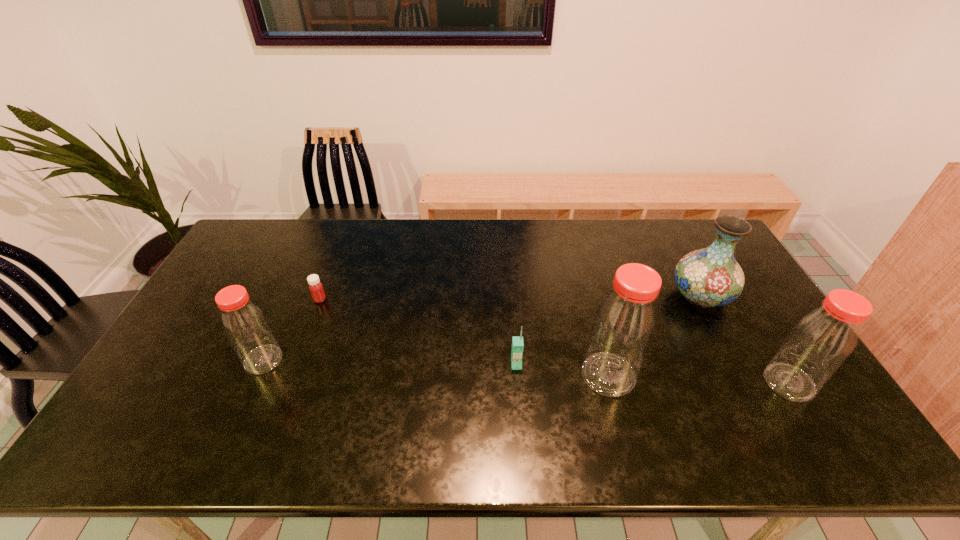
The width and height of the screenshot is (960, 540). I want to click on vacant region located 0.070m on the left of the second bottle from left to right, so click(555, 375).

Where is `vacant space located 0.320m on the back of the second tallest bottle`? The width and height of the screenshot is (960, 540). vacant space located 0.320m on the back of the second tallest bottle is located at coordinates (729, 283).

Where is `blank space located 0.060m on the keypad of the third object from left to right`? The image size is (960, 540). blank space located 0.060m on the keypad of the third object from left to right is located at coordinates (518, 389).

This screenshot has width=960, height=540. Identify the location of blank space located 0.270m on the front of the vase. (754, 396).

Locate an element on the screen. vacant region located on the front of the fifth object from right to left is located at coordinates (313, 318).

You are a GUI agent. You are given a task and a screenshot of the screen. Output one action in this format:
    pyautogui.click(x=<x>, y=<y>)
    Task: Click on the bottle that is positioned at the right edge
    Image resolution: width=960 pixels, height=540 pixels.
    Given the screenshot: What is the action you would take?
    pyautogui.click(x=822, y=340)

Where is `vase that is at the right edge`? The height and width of the screenshot is (540, 960). vase that is at the right edge is located at coordinates (710, 277).

Locate an element on the screen. This screenshot has height=540, width=960. object present at the near right corner is located at coordinates (822, 340).

What are the coordinates of `free region at the far edge` in the screenshot? It's located at (629, 258).

What are the coordinates of `vacant region at the near edge of the desktop` in the screenshot? It's located at (526, 393).